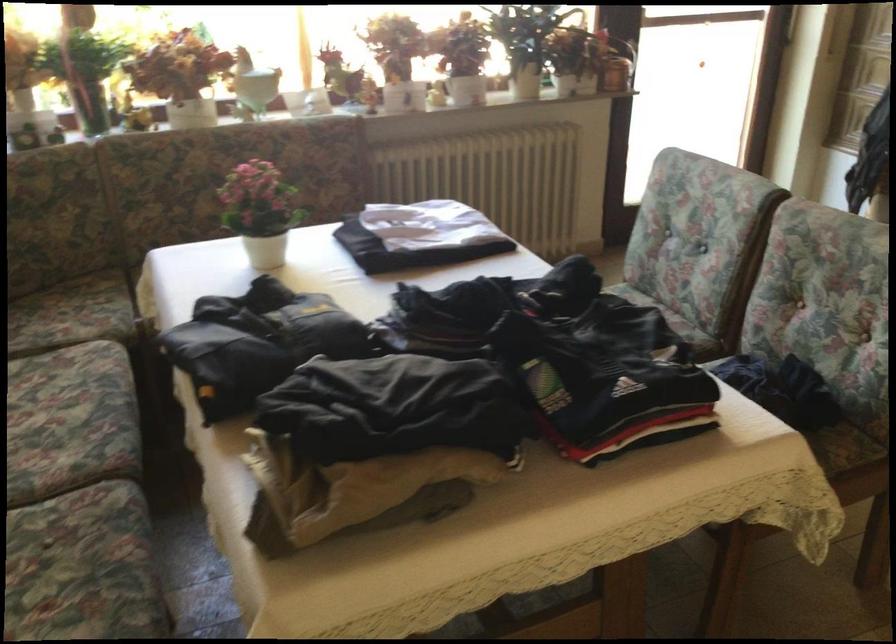
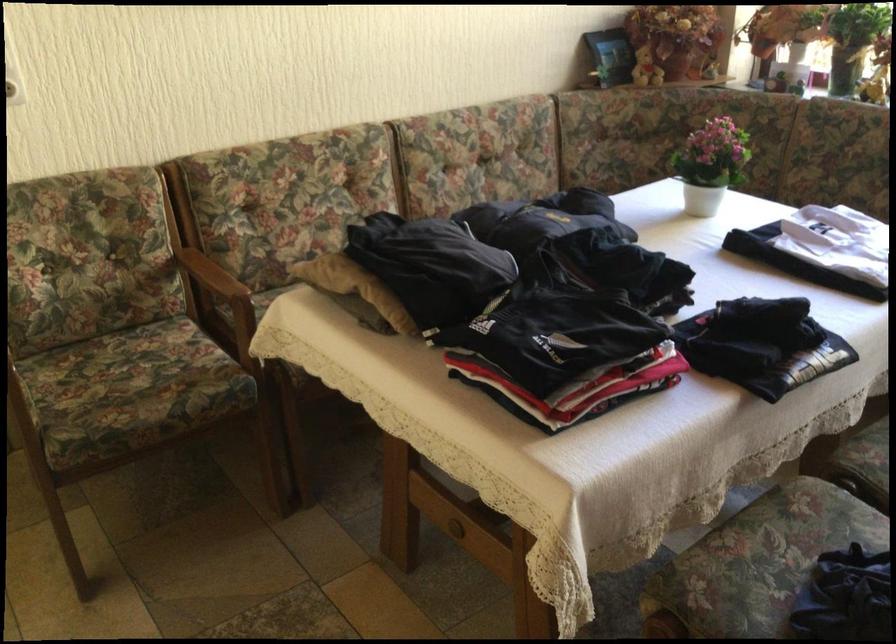
Question: I am providing you with two images of the same scene from different viewpoints. After the viewpoint changes to image2, which objects are now occluded?

Choices:
 (A) wooden chair armrest
 (B) chair sitting surface
 (C) white plastic shaker
 (D) white flower pot

Answer: (B)